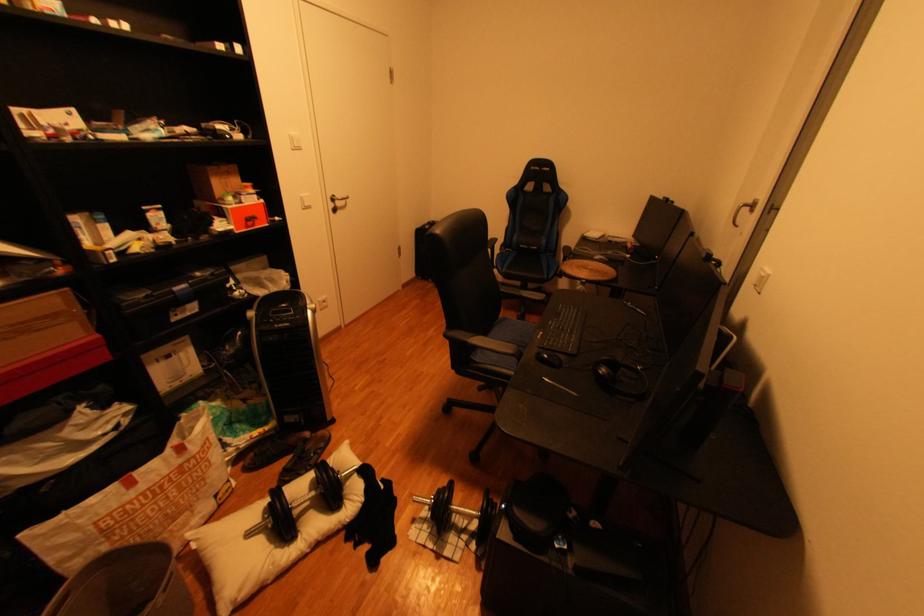
Where is `orange cardboard box`? The width and height of the screenshot is (924, 616). orange cardboard box is located at coordinates (214, 180).